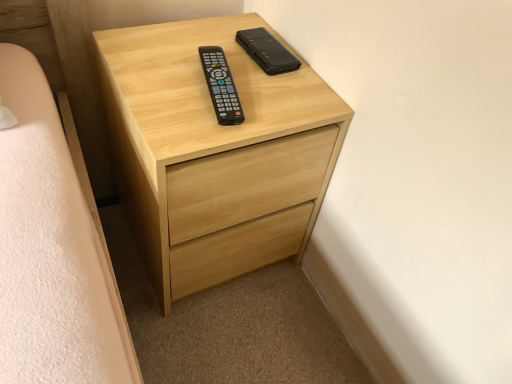
The height and width of the screenshot is (384, 512). I want to click on vacant area that is in front of black leather phone case at upper center, positioned as the first control in back-to-front order, so click(x=260, y=100).